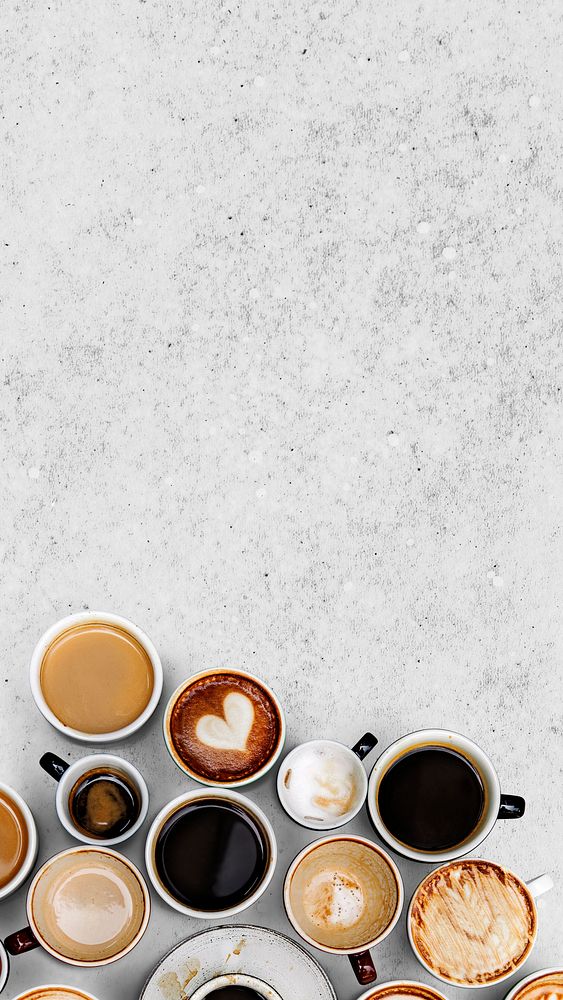
This screenshot has height=1000, width=563. What are the coordinates of `cup handles` in the screenshot? It's located at (52, 766), (15, 948), (370, 744), (513, 802), (365, 968).